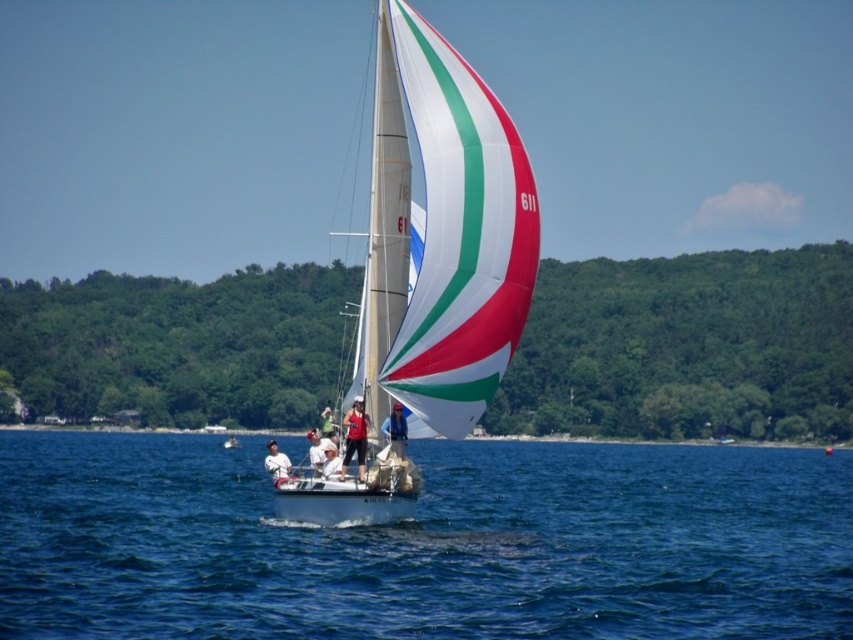
Question: Does white fabric sailboat at center come in front of matte red shirt at center?

Choices:
 (A) no
 (B) yes

Answer: (B)

Question: Which object is positioned closest to the matte red shirt at center?

Choices:
 (A) white fabric sailboat at center
 (B) white cotton shirt at center
 (C) matte red tank top at center
 (D) white fabric hat at center

Answer: (A)

Question: Which point is farther to the camera?

Choices:
 (A) blue fabric sailboat at center
 (B) white fabric hat at center

Answer: (B)

Question: Does white glossy sailboat at center have a lesser width compared to white fabric hat at center?

Choices:
 (A) yes
 (B) no

Answer: (B)

Question: Estimate the real-world distances between objects in this image. Which object is farther from the matte red tank top at center?

Choices:
 (A) matte red shirt at center
 (B) blue water at center
 (C) white glossy sailboat at center

Answer: (B)

Question: Can you confirm if matte red tank top at center is positioned to the right of white cotton shirt at center?

Choices:
 (A) yes
 (B) no

Answer: (A)